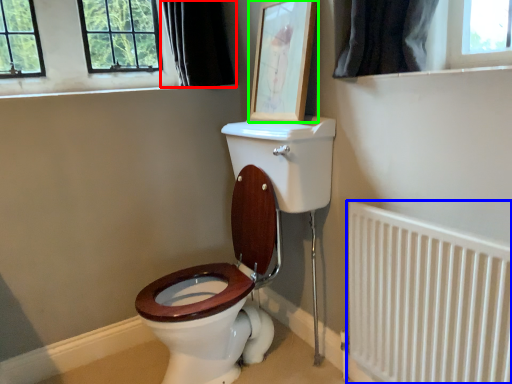
Question: Which is nearer to the curtain (highlighted by a red box)? radiator (highlighted by a blue box) or picture frame (highlighted by a green box).

Choices:
 (A) radiator
 (B) picture frame

Answer: (B)